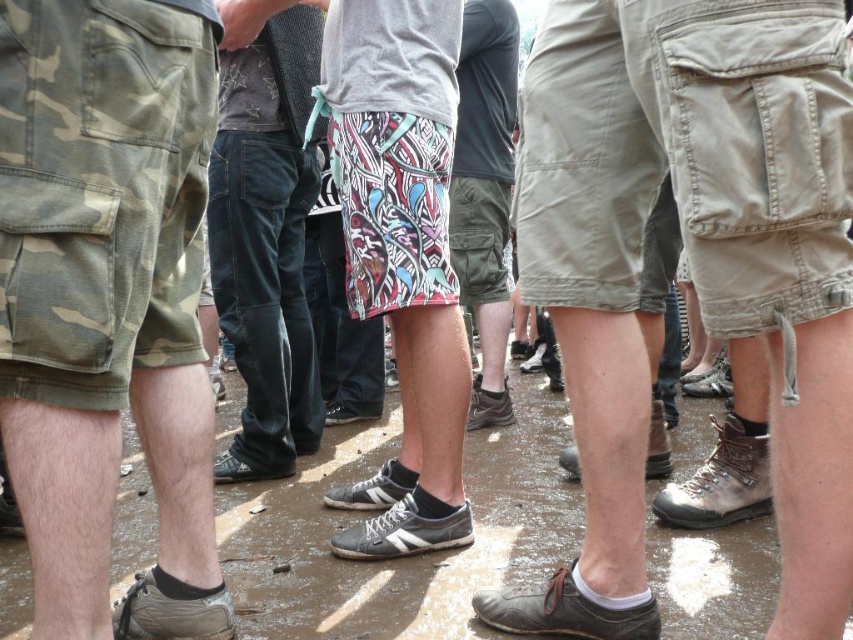
Looking at the group of people in the image, which pair of shorts, the khaki cotton shorts at right or the multicolored printed shorts at center, has a narrower width?

The khaki cotton shorts at right is thinner than the multicolored printed shorts at center, so the khaki cotton shorts at right has a narrower width.

You are standing at the point marked as point (x=213, y=188). You need to reach a friend who is standing 4.11 meters away from you. What is the shortest distance you need to walk to reach them?

The shortest distance you need to walk is 4.11 meters, as the friend is 4.11 meters away from the point (x=213, y=188).

Looking at the group of people in the image, which pair of shorts, the khaki cotton shorts at right or the multicolored printed shorts at center, appears bigger in size?

The khaki cotton shorts at right is larger in size than the multicolored printed shorts at center.